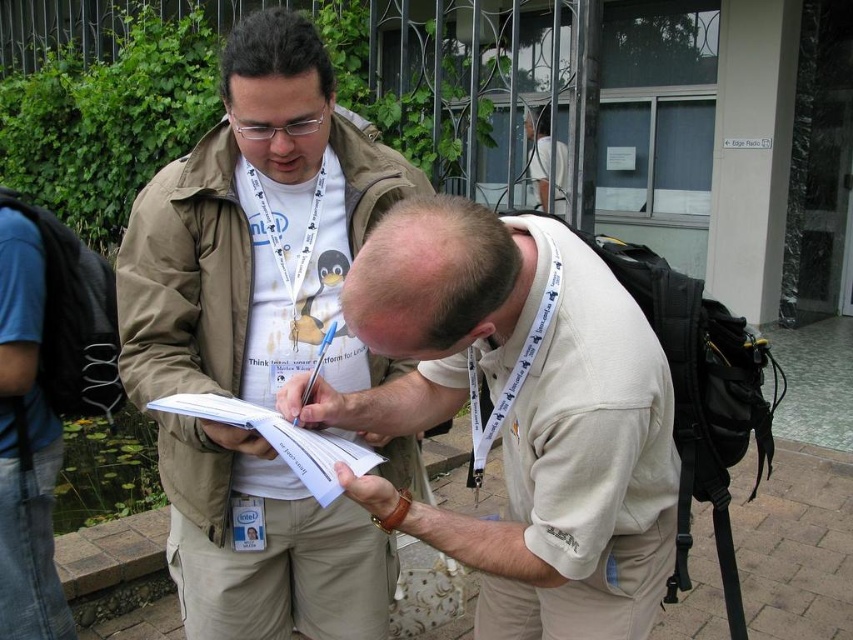
Question: Is khaki pants at center above beige cotton shirt at center?

Choices:
 (A) no
 (B) yes

Answer: (B)

Question: Which point is closer to the camera?

Choices:
 (A) (44, 563)
 (B) (260, 410)
 (C) (554, 499)

Answer: (C)

Question: Is khaki pants at center wider than blue denim jeans at lower left?

Choices:
 (A) no
 (B) yes

Answer: (B)

Question: Does beige cotton shirt at center appear under blue denim jeans at lower left?

Choices:
 (A) no
 (B) yes

Answer: (A)

Question: Among these objects, which one is nearest to the camera?

Choices:
 (A) white paper at center
 (B) beige cotton shirt at center
 (C) blue denim jeans at lower left
 (D) khaki pants at center

Answer: (B)

Question: Which point is farther to the camera?

Choices:
 (A) beige cotton shirt at center
 (B) khaki pants at center
 (C) white paper at center

Answer: (B)